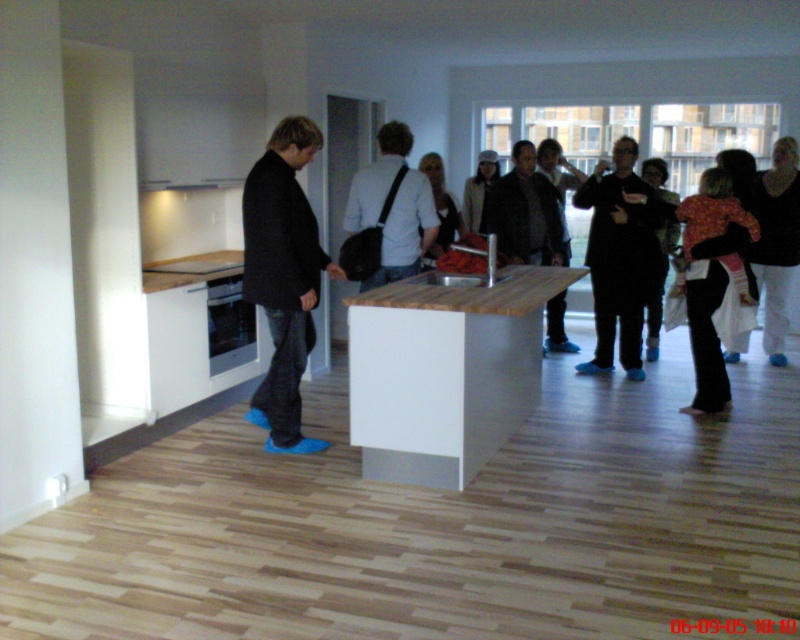
Is dark wool coat at left to the left of black matte coat at center from the viewer's perspective?

Yes, dark wool coat at left is to the left of black matte coat at center.

Is point (276, 230) behind point (620, 182)?

No, it is in front of (620, 182).

Locate an element on the screen. The image size is (800, 640). dark wool coat at left is located at coordinates pos(284,276).

I want to click on dark wool coat at left, so click(284, 276).

Between floral fabric dress at right and white textured jacket at center, which one has more height?

Standing taller between the two is floral fabric dress at right.

Describe the element at coordinates (712, 276) in the screenshot. Image resolution: width=800 pixels, height=640 pixels. I see `floral fabric dress at right` at that location.

Locate an element on the screen. floral fabric dress at right is located at coordinates (712, 276).

Between dark brown leather jacket at center and white textured jacket at center, which one appears on the right side from the viewer's perspective?

Positioned to the right is dark brown leather jacket at center.

Between dark brown leather jacket at center and white textured jacket at center, which one is positioned lower?

dark brown leather jacket at center is lower down.

What do you see at coordinates (525, 212) in the screenshot? I see `dark brown leather jacket at center` at bounding box center [525, 212].

Where is `dark brown leather jacket at center`? dark brown leather jacket at center is located at coordinates (525, 212).